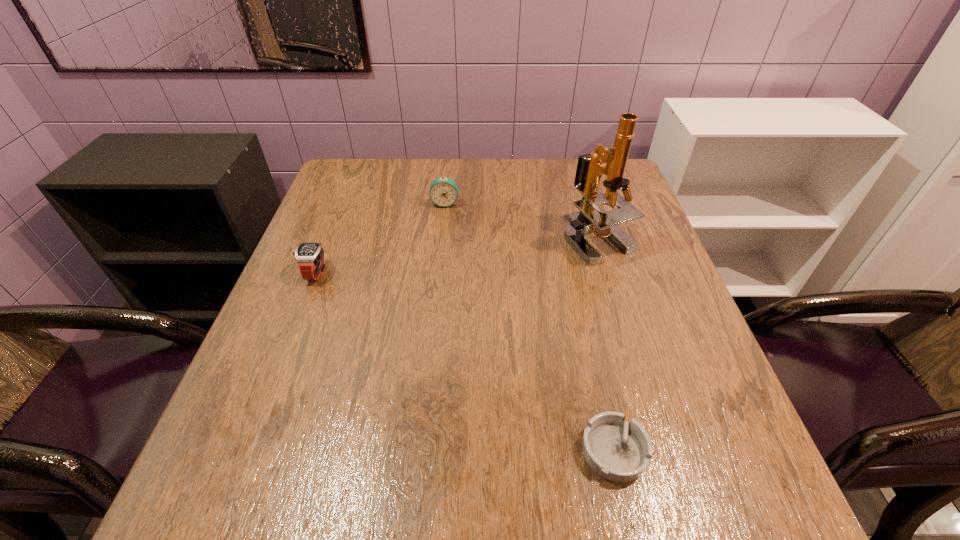
This screenshot has width=960, height=540. In order to click on the third closest object to the alarm clock in this screenshot , I will do `click(617, 449)`.

Select which object is the closest to the leftmost object. Please provide its 2D coordinates. Your answer should be formatted as a tuple, i.e. [(x, y)], where the tuple contains the x and y coordinates of a point satisfying the conditions above.

[(443, 192)]

I want to click on vacant space that satisfies the following two spatial constraints: 1. on the front side of the second shortest object; 2. on the right side of the shortest object, so click(246, 449).

At what (x,y) coordinates should I click in order to perform the action: click on free spot that satisfies the following two spatial constraints: 1. on the front-facing side of the shortest object; 2. on the right side of the alarm clock. Please return your answer as a coordinate pair (x, y). Image resolution: width=960 pixels, height=540 pixels. Looking at the image, I should click on (420, 449).

This screenshot has width=960, height=540. Identify the location of free region that satisfies the following two spatial constraints: 1. on the front-facing side of the farthest object; 2. on the left side of the ashtray. (420, 449).

Find the location of a particular element. This screenshot has width=960, height=540. vacant space that satisfies the following two spatial constraints: 1. on the front-facing side of the shortest object; 2. on the left side of the second object from left to right is located at coordinates (420, 449).